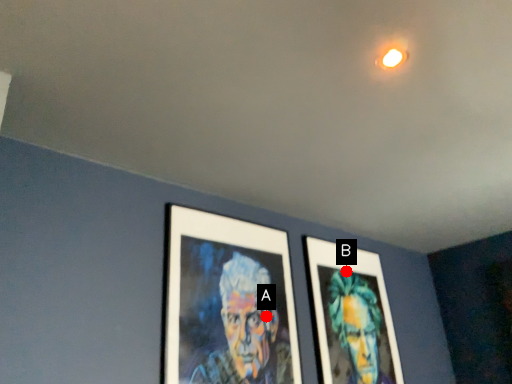
Question: Two points are circled on the image, labeled by A and B beside each circle. Which point is closer to the camera?

Choices:
 (A) A is closer
 (B) B is closer

Answer: (A)